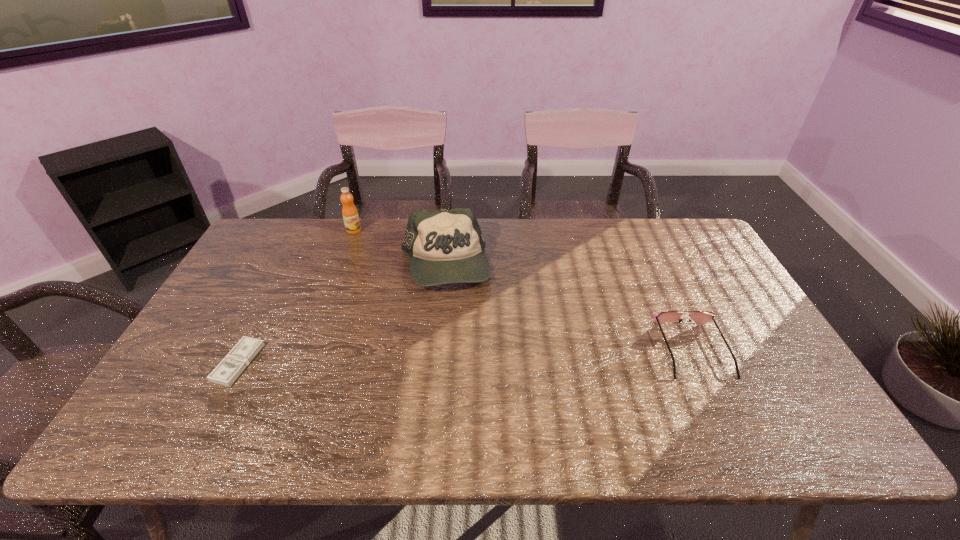
The height and width of the screenshot is (540, 960). I want to click on vacant space positioned 0.070m on the front-facing side of the third object from left to right, so click(441, 314).

At what (x,y) coordinates should I click in order to perform the action: click on free space located 0.220m on the front-facing side of the third object from left to right. Please return your answer as a coordinate pair (x, y). This screenshot has width=960, height=540. Looking at the image, I should click on (438, 356).

You are a GUI agent. You are given a task and a screenshot of the screen. Output one action in this format:
    pyautogui.click(x=<x>, y=<y>)
    Task: Click on the blank space located on the front-facing side of the third object from left to right
    
    Given the screenshot: What is the action you would take?
    pyautogui.click(x=440, y=339)

Locate an element on the screen. free spot located on the front label of the orange juice is located at coordinates (371, 271).

At what (x,y) coordinates should I click in order to perform the action: click on free region located on the front label of the orange juice. Please return your answer as a coordinate pair (x, y). This screenshot has height=540, width=960. Looking at the image, I should click on (361, 247).

At what (x,y) coordinates should I click in order to perform the action: click on vacant point located 0.210m on the front label of the orange juice. Please return your answer as a coordinate pair (x, y). The width and height of the screenshot is (960, 540). Looking at the image, I should click on (371, 269).

Where is `baseball cap that is positioned at the far edge`? baseball cap that is positioned at the far edge is located at coordinates (445, 247).

At what (x,y) coordinates should I click in order to perform the action: click on orange juice that is at the far edge. Please return your answer as a coordinate pair (x, y). Image resolution: width=960 pixels, height=540 pixels. Looking at the image, I should click on (350, 215).

At what (x,y) coordinates should I click in order to perform the action: click on money that is positioned at the near edge. Please return your answer as a coordinate pair (x, y). Looking at the image, I should click on (228, 370).

You are a GUI agent. You are given a task and a screenshot of the screen. Output one action in this format:
    pyautogui.click(x=<x>, y=<y>)
    Task: Click on the sunglasses situated at the near edge
    Image resolution: width=960 pixels, height=540 pixels.
    Given the screenshot: What is the action you would take?
    pyautogui.click(x=699, y=317)